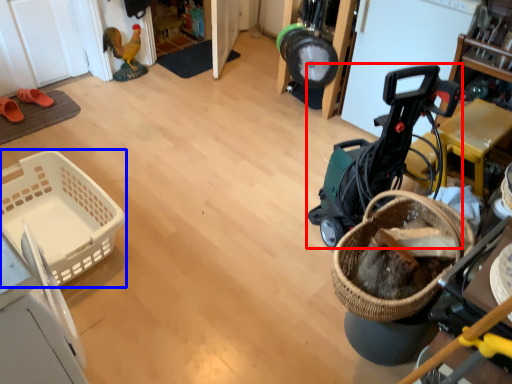
Question: Which point is closer to the camera, baby carriage (highlighted by a red box) or basket (highlighted by a blue box)?

Choices:
 (A) baby carriage
 (B) basket

Answer: (A)